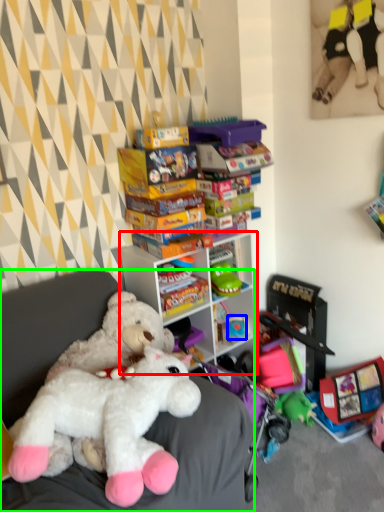
Question: Considering the real-world distances, which object is closest to cabinetry (highlighted by a red box)? toy (highlighted by a blue box) or furniture (highlighted by a green box).

Choices:
 (A) toy
 (B) furniture

Answer: (A)